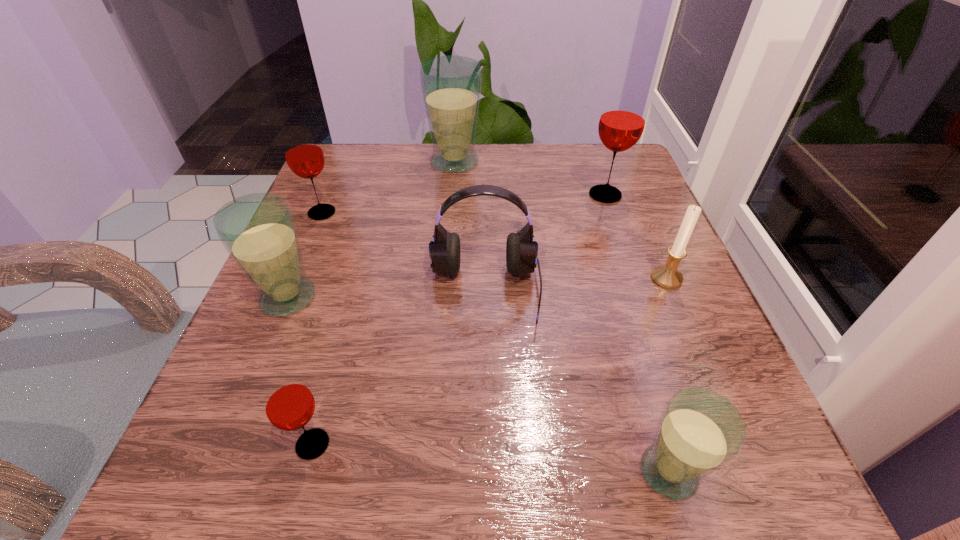
At what (x,y) coordinates should I click in order to perform the action: click on free location that satisfies the following two spatial constraints: 1. on the ear cushions of the nearest blue glass; 2. on the right side of the headset. Please return your answer as a coordinate pair (x, y). Looking at the image, I should click on (487, 472).